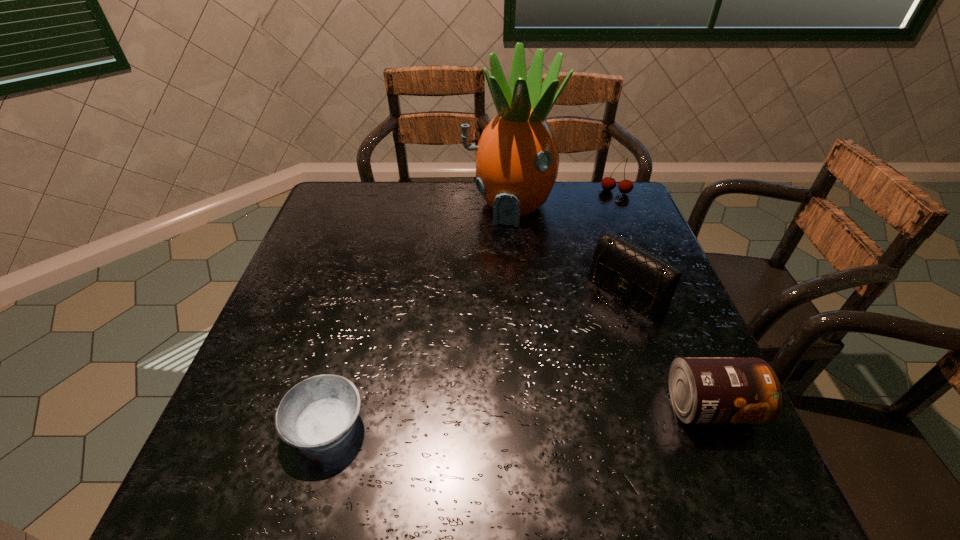
Image resolution: width=960 pixels, height=540 pixels. Identify the location of the leftmost object. (318, 413).

Image resolution: width=960 pixels, height=540 pixels. Identify the location of the shortest object. (318, 413).

Find the location of a particular element. can is located at coordinates (703, 390).

Find the location of a particular element. cherry is located at coordinates (625, 186).

Locate an element on the screen. The width and height of the screenshot is (960, 540). the third farthest object is located at coordinates (645, 282).

The height and width of the screenshot is (540, 960). In order to click on the fourth object from right to left in this screenshot , I will do `click(517, 159)`.

You are a GUI agent. You are given a task and a screenshot of the screen. Output one action in this format:
    pyautogui.click(x=<x>, y=<y>)
    Task: Click on the tallest object
    This screenshot has width=960, height=540.
    Given the screenshot: What is the action you would take?
    pyautogui.click(x=517, y=159)

You are a GUI agent. You are given a task and a screenshot of the screen. Output one action in this format:
    pyautogui.click(x=<x>, y=<y>)
    Task: Click on the vacant space located on the right of the shortest object
    Image resolution: width=960 pixels, height=540 pixels.
    Given the screenshot: What is the action you would take?
    pyautogui.click(x=586, y=427)

Where is `free location located 0.320m on the surface of the cherry`? Image resolution: width=960 pixels, height=540 pixels. free location located 0.320m on the surface of the cherry is located at coordinates (587, 259).

You are a GUI agent. You are given a task and a screenshot of the screen. Output one action in this format:
    pyautogui.click(x=<x>, y=<y>)
    Task: Click on the vacant space located 0.370m on the surface of the cherry
    
    Given the screenshot: What is the action you would take?
    pyautogui.click(x=582, y=271)